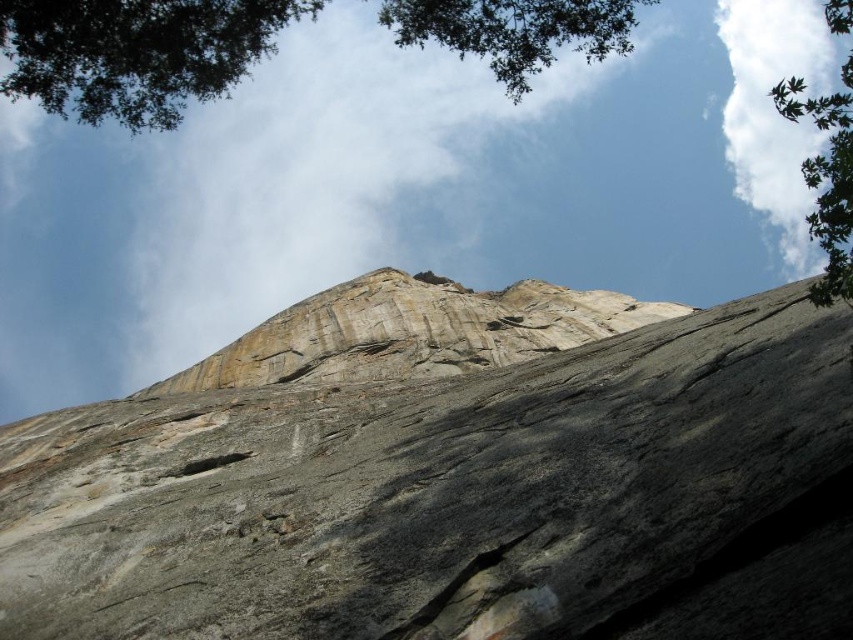
You are standing at the base of the rock formation and notice two green leafy trees in the distance. Which tree, the green leafy tree at upper center or the green leafy tree at upper right, is located to the left when viewed from your perspective?

The green leafy tree at upper center is positioned on the left side of the green leafy tree at upper right, so from your perspective at the base of the rock formation, the green leafy tree at upper center is located to the left.